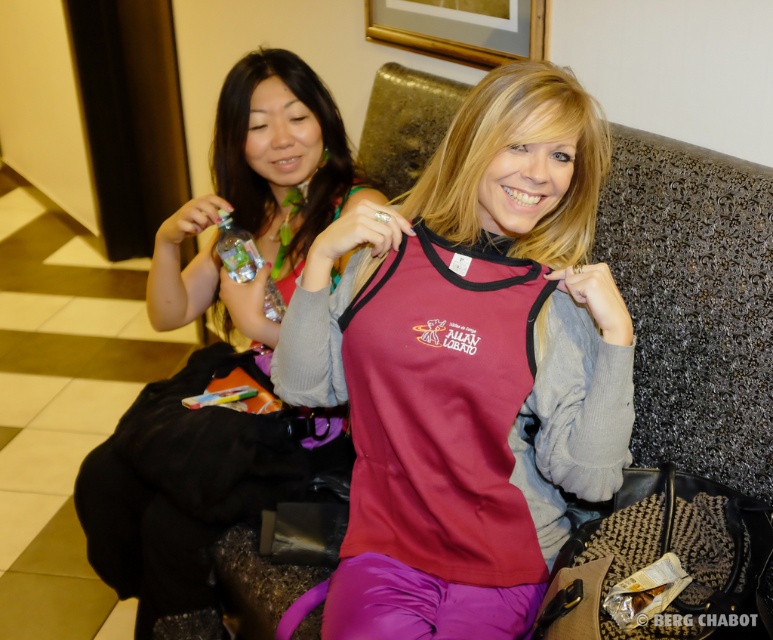
Question: Can you confirm if matte red fabric shirt at center is positioned above clear plastic bottle at upper left?

Choices:
 (A) yes
 (B) no

Answer: (B)

Question: Based on their relative distances, which object is nearer to the matte red fabric shirt at center?

Choices:
 (A) matte black shirt at left
 (B) clear plastic bottle at upper left

Answer: (A)

Question: Can you confirm if matte black shirt at left is positioned to the right of clear plastic bottle at upper left?

Choices:
 (A) yes
 (B) no

Answer: (A)

Question: Can you confirm if matte red fabric shirt at center is bigger than matte black shirt at left?

Choices:
 (A) yes
 (B) no

Answer: (B)

Question: Which object is positioned farthest from the matte black shirt at left?

Choices:
 (A) matte red fabric shirt at center
 (B) clear plastic bottle at upper left

Answer: (A)

Question: Based on their relative distances, which object is farther from the matte black shirt at left?

Choices:
 (A) clear plastic bottle at upper left
 (B) matte red fabric shirt at center

Answer: (B)